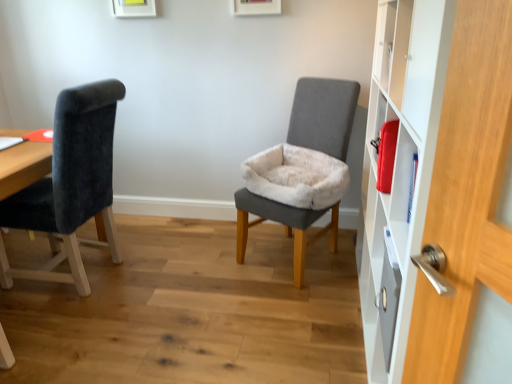
This screenshot has width=512, height=384. In order to click on free point below gray fabric chair at center, which is the 1th chair from right to left (from a real-world perspective) in this screenshot , I will do `click(286, 260)`.